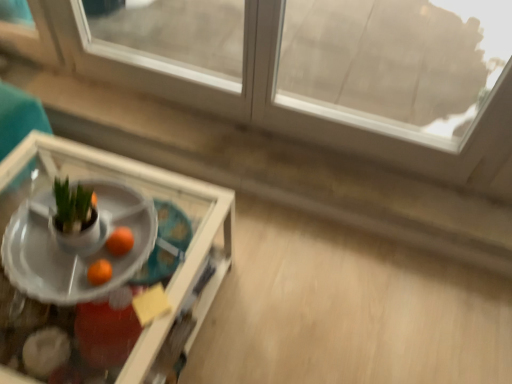
Question: From a real-world perspective, does clear glass tray at lower left, which is the 1th table in front-to-back order, stand above orange matte at center?

Choices:
 (A) yes
 (B) no

Answer: (B)

Question: Does clear glass tray at lower left, the second table from the back, come behind orange matte at center?

Choices:
 (A) yes
 (B) no

Answer: (B)

Question: From the image's perspective, would you say clear glass tray at lower left, the second table from the back, is shown under orange matte at center?

Choices:
 (A) no
 (B) yes

Answer: (B)

Question: Would you say orange matte at center is part of clear glass tray at lower left, which is the 1th table in front-to-back order,'s contents?

Choices:
 (A) no
 (B) yes

Answer: (A)

Question: Can you confirm if clear glass tray at lower left, the second table from the back, is bigger than orange matte at center?

Choices:
 (A) no
 (B) yes

Answer: (B)

Question: From the image's perspective, is transparent glass window at upper center above or below orange matte at center?

Choices:
 (A) above
 (B) below

Answer: (A)

Question: Considering the positions of transparent glass window at upper center and orange matte at center in the image, is transparent glass window at upper center wider or thinner than orange matte at center?

Choices:
 (A) thin
 (B) wide

Answer: (B)

Question: Is transparent glass window at upper center spatially inside orange matte at center, or outside of it?

Choices:
 (A) outside
 (B) inside

Answer: (A)

Question: In terms of size, does transparent glass window at upper center appear bigger or smaller than orange matte at center?

Choices:
 (A) big
 (B) small

Answer: (A)

Question: Is white glossy tray at center, which is counted as the second table, starting from the front, spatially inside transparent glass window at upper center, or outside of it?

Choices:
 (A) outside
 (B) inside

Answer: (A)

Question: Is white glossy tray at center, which is the first table from back to front, bigger or smaller than transparent glass window at upper center?

Choices:
 (A) big
 (B) small

Answer: (B)

Question: From a real-world perspective, is white glossy tray at center, which is counted as the second table, starting from the front, positioned above or below transparent glass window at upper center?

Choices:
 (A) below
 (B) above

Answer: (A)

Question: From the image's perspective, is white glossy tray at center, which is the first table from back to front, located above or below transparent glass window at upper center?

Choices:
 (A) below
 (B) above

Answer: (A)

Question: Do you think orange matte at center is within white glossy tray at center, which is the first table from back to front, or outside of it?

Choices:
 (A) outside
 (B) inside

Answer: (B)

Question: Is orange matte at center wider or thinner than white glossy tray at center, which is the first table from back to front?

Choices:
 (A) thin
 (B) wide

Answer: (A)